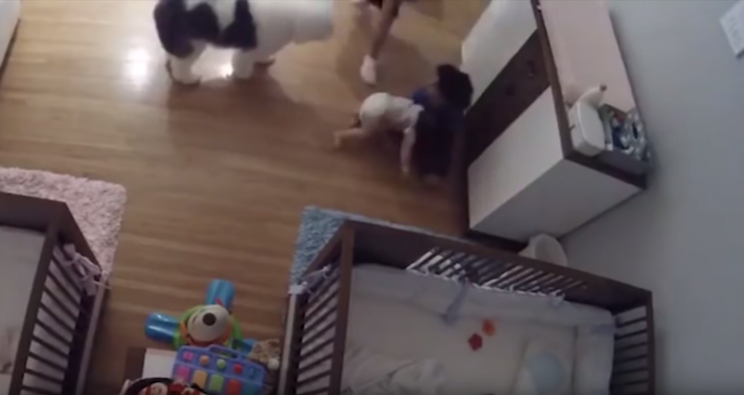
Identify the location of space between cribs. This screenshot has width=744, height=395. (123, 321).